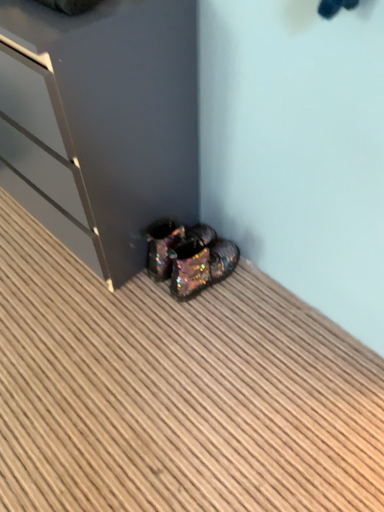
Locate an element on the screen. The width and height of the screenshot is (384, 512). vacant area to the right of iridescent glittery shoes at lower center is located at coordinates (259, 287).